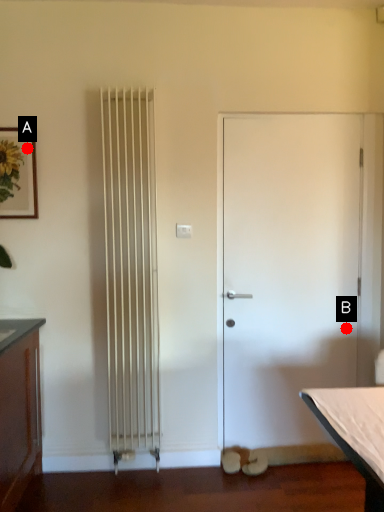
Question: Two points are circled on the image, labeled by A and B beside each circle. Which point is farther from the camera taking this photo?

Choices:
 (A) A is further
 (B) B is further

Answer: (B)